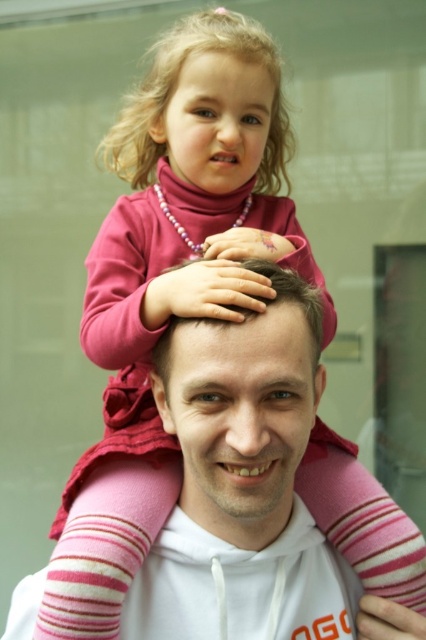
You are a photographer trying to capture a candid shot of the man and girl in the image. You need to ensure that both the pink fleece jacket at upper center and the pink fabric head at center are clearly visible in the frame. Given their distance apart, is it feasible to include both in a single photo without zooming in or out?

The pink fleece jacket at upper center and the pink fabric head at center are 22.53 centimeters apart. Since they are only about 22.5 cm apart, it should be feasible to capture both in a single photo without needing to adjust the zoom, as this distance is manageable within a standard camera frame.

Based on the scene, which object is wider between the pink fleece jacket at upper center and the pink fabric head at center?

The pink fleece jacket at upper center is wider than the pink fabric head at center.

Based on the scene description, which object is positioned higher in the image between the pink fleece jacket at upper center and the pink fabric head at center?

The pink fleece jacket at upper center is positioned higher than the pink fabric head at center because it is described as much taller.